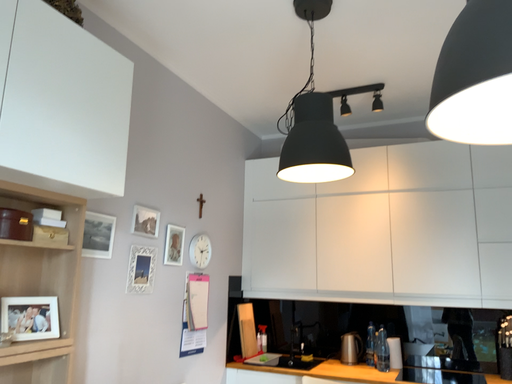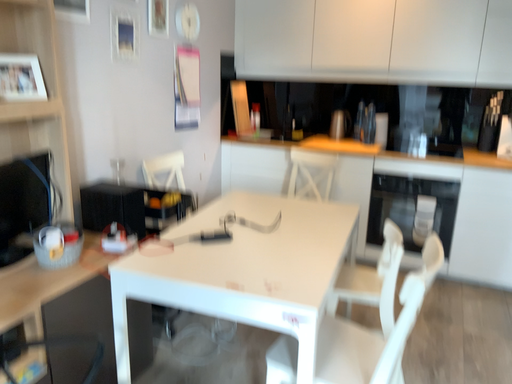
Question: Which way did the camera rotate in the video?

Choices:
 (A) rotated downward
 (B) rotated upward

Answer: (A)